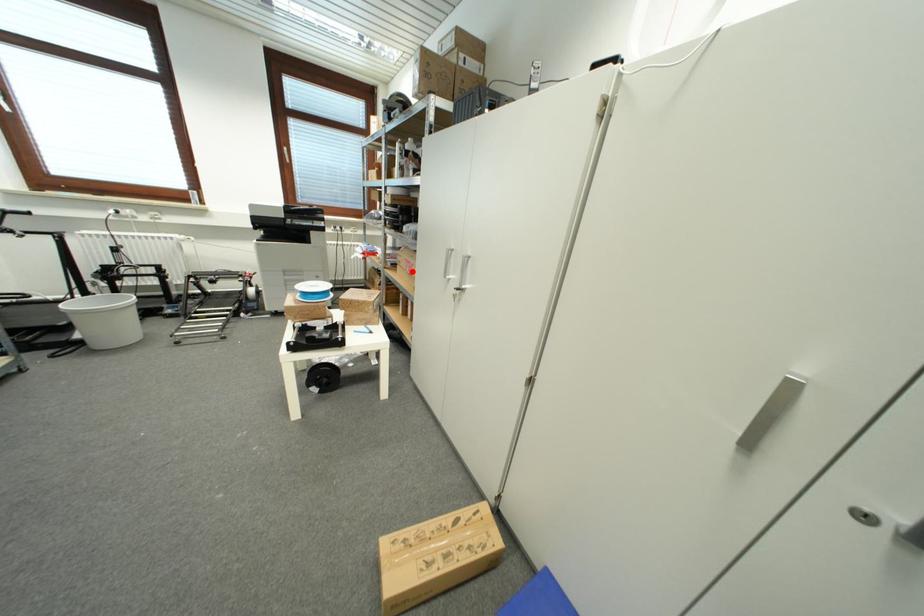
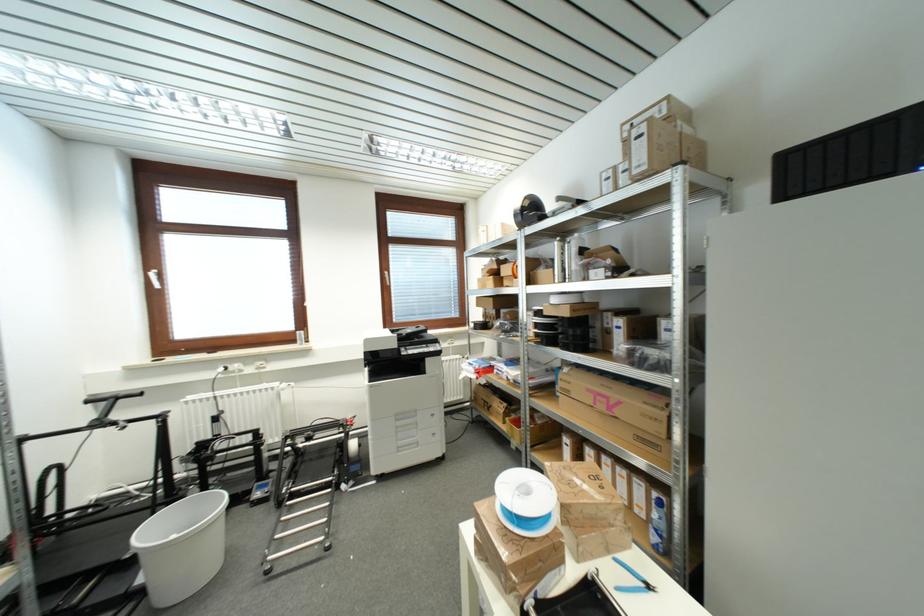
Question: I am providing you with two images of the same scene from different viewpoints. A red point is shown in image1. For the corresponding object point in image2, is it positioned nearer or farther from the camera?

Choices:
 (A) Nearer
 (B) Farther

Answer: (B)